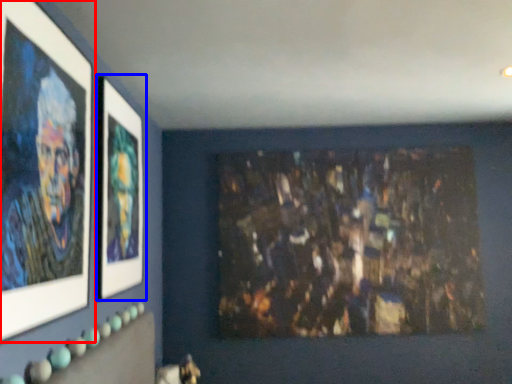
Question: Which of the following is the closest to the observer, picture frame (highlighted by a red box) or picture frame (highlighted by a blue box)?

Choices:
 (A) picture frame
 (B) picture frame

Answer: (A)